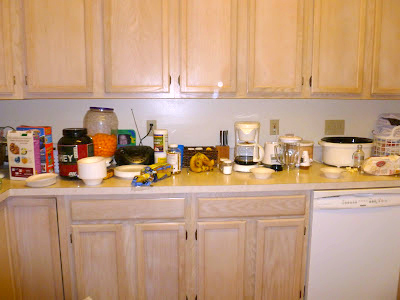
Identify the location of coffee maker. (247, 150).